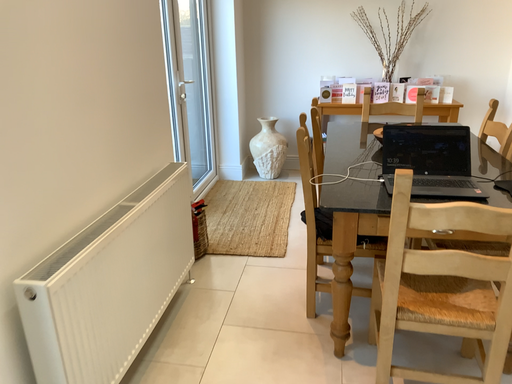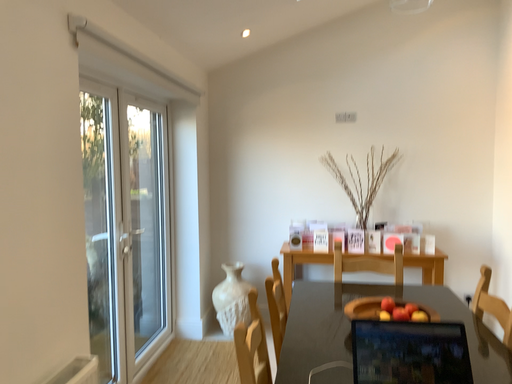
Question: How did the camera likely rotate when shooting the video?

Choices:
 (A) rotated upward
 (B) rotated downward

Answer: (A)